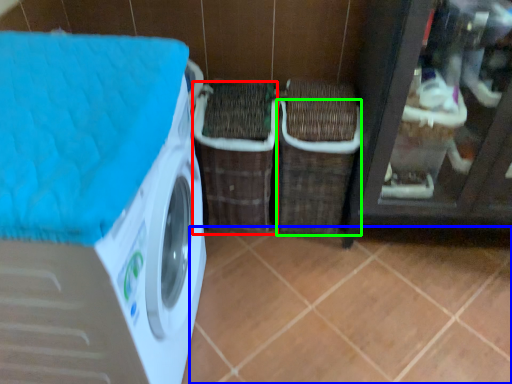
Question: Estimate the real-world distances between objects in this image. Which object is farther from basket (highlighted by a red box), tile (highlighted by a blue box) or basket (highlighted by a green box)?

Choices:
 (A) tile
 (B) basket

Answer: (A)